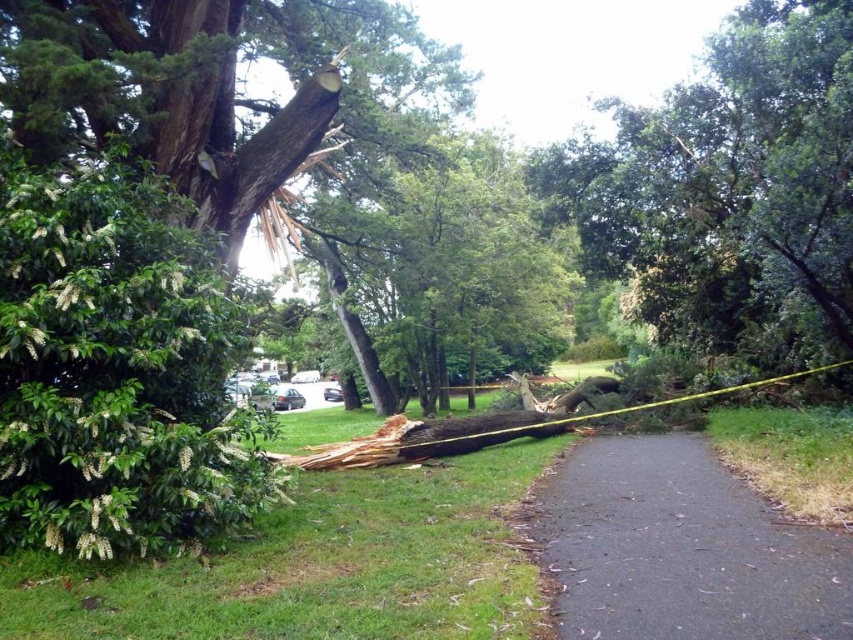
You are a park maintenance worker who needs to transport the green textured trunk at center to the recycling area. The recycling area is accessible only through the black asphalt path at center. Considering the length of the trunk and the path, do you think you can move it through the path without any adjustments?

The black asphalt path at center is shorter than the green textured trunk at center, so the trunk cannot be moved through the path without adjustments because it is longer than the available path length.

You are a gardener who needs to move a 3 meter long fallen tree trunk from the park. You see the brown rough wood at center and the black asphalt path at center. Is there enough space between them to move the trunk without touching either?

The brown rough wood at center and black asphalt path at center are 2.77 meters apart. Since the trunk is 3 meters long, which is longer than the space between them, you cannot move the trunk without touching either object.

You are a gardener planning to walk from the green textured trunk at center to the black asphalt path at center. Which direction should you move to reach the path?

The black asphalt path at center is located to the right of the green textured trunk at center, so you should move to the right to reach it.